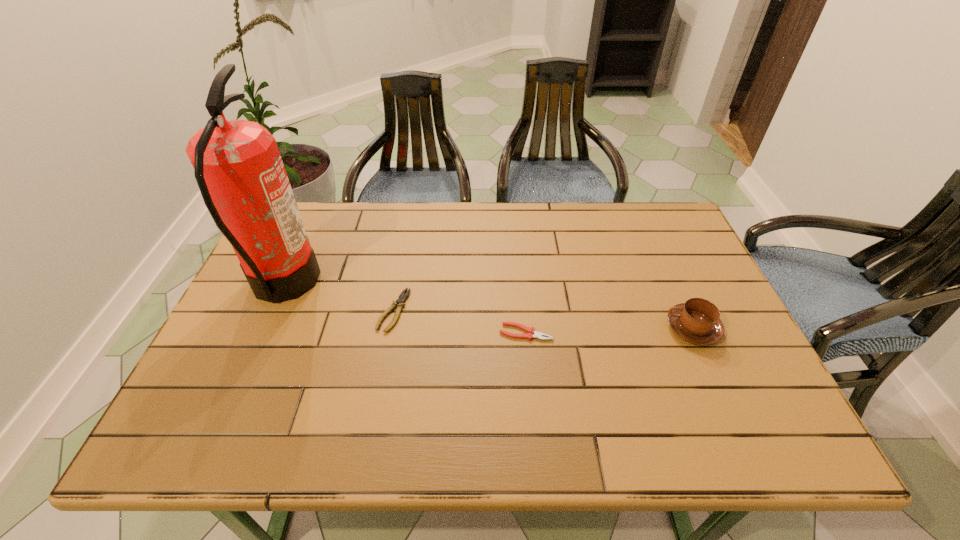
You are a GUI agent. You are given a task and a screenshot of the screen. Output one action in this format:
    pyautogui.click(x=<x>, y=<y>)
    Task: Click on the free space that satisfies the following two spatial constraints: 1. on the front side of the right pliers; 2. on the right side of the tallest object
    The width and height of the screenshot is (960, 540).
    Given the screenshot: What is the action you would take?
    pyautogui.click(x=262, y=332)

In order to click on blank space that satisfies the following two spatial constraints: 1. on the front side of the second object from left to right; 2. on the left side of the tallest object in this screenshot , I will do `click(272, 310)`.

Where is `free space in the image that satisfies the following two spatial constraints: 1. on the front side of the third object from left to right; 2. on the left side of the fire extinguisher`? Image resolution: width=960 pixels, height=540 pixels. free space in the image that satisfies the following two spatial constraints: 1. on the front side of the third object from left to right; 2. on the left side of the fire extinguisher is located at coordinates (262, 332).

This screenshot has height=540, width=960. I want to click on vacant space that satisfies the following two spatial constraints: 1. on the front side of the fire extinguisher; 2. on the back side of the second object from right to left, so click(x=262, y=332).

Locate an element on the screen. This screenshot has width=960, height=540. free point that satisfies the following two spatial constraints: 1. on the front side of the leftmost object; 2. on the left side of the third object from left to right is located at coordinates (262, 332).

Find the location of `vacant space that satisfies the following two spatial constraints: 1. on the back side of the right pliers; 2. on the front side of the leftmost object`. vacant space that satisfies the following two spatial constraints: 1. on the back side of the right pliers; 2. on the front side of the leftmost object is located at coordinates (521, 284).

Identify the location of vacant space that satisfies the following two spatial constraints: 1. on the side of the rightmost object with the handle; 2. on the front side of the right pliers. The height and width of the screenshot is (540, 960). (695, 332).

Locate an element on the screen. blank space that satisfies the following two spatial constraints: 1. on the front side of the second object from left to right; 2. on the left side of the leftmost object is located at coordinates (272, 310).